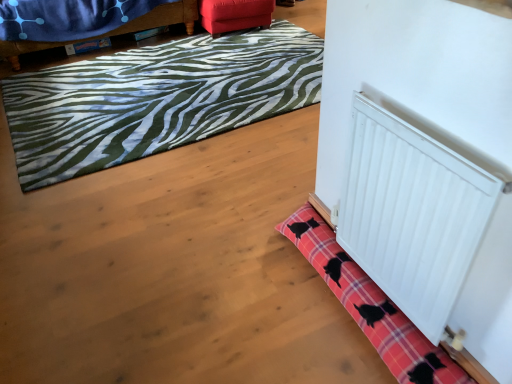
Where is `vacant area on the back side of pink plaid bath mat at lower right, placed as the 1th bath mat when sorted from front to back`? vacant area on the back side of pink plaid bath mat at lower right, placed as the 1th bath mat when sorted from front to back is located at coordinates (265, 190).